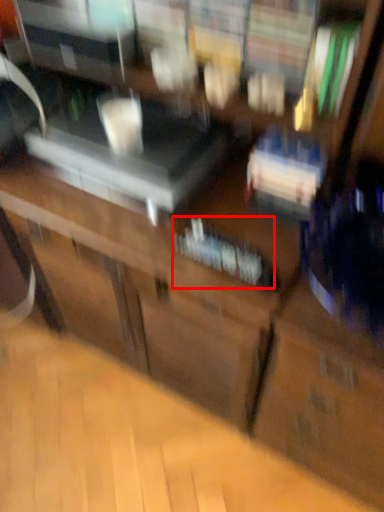
Question: From the image's perspective, what is the correct spatial positioning of book (annotated by the red box) in reference to furniture?

Choices:
 (A) above
 (B) below

Answer: (B)